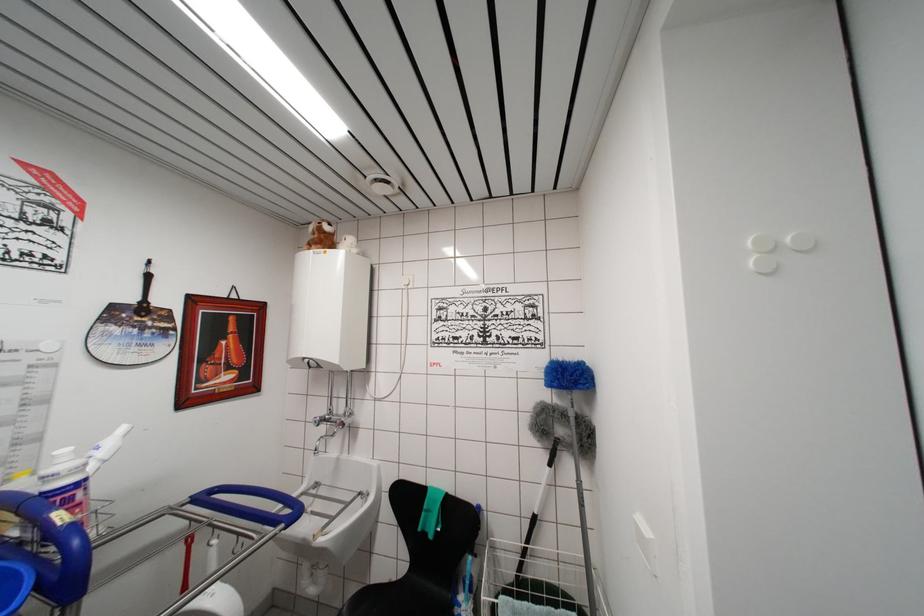
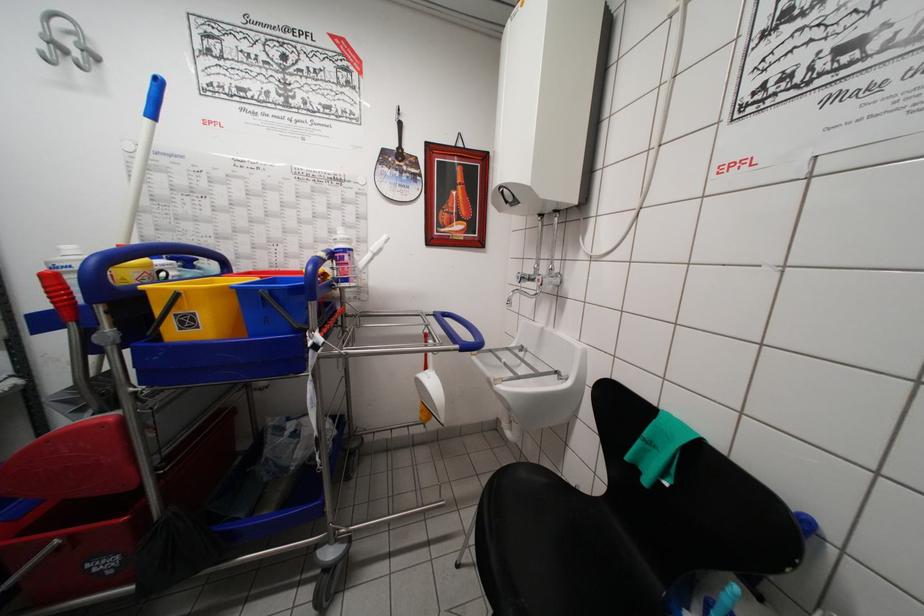
Where in the second image is the point corresponding to the point at 319,426 from the first image?

(521, 282)